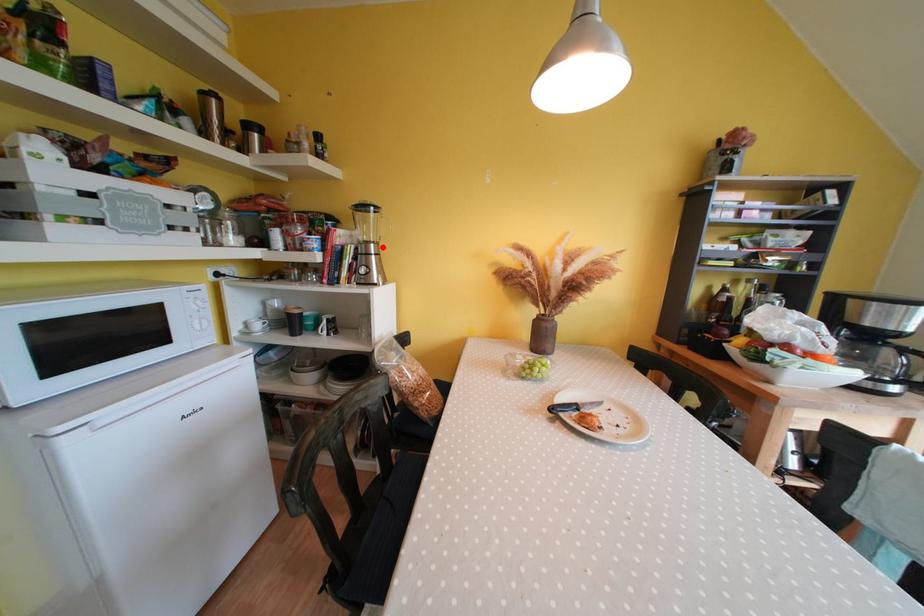
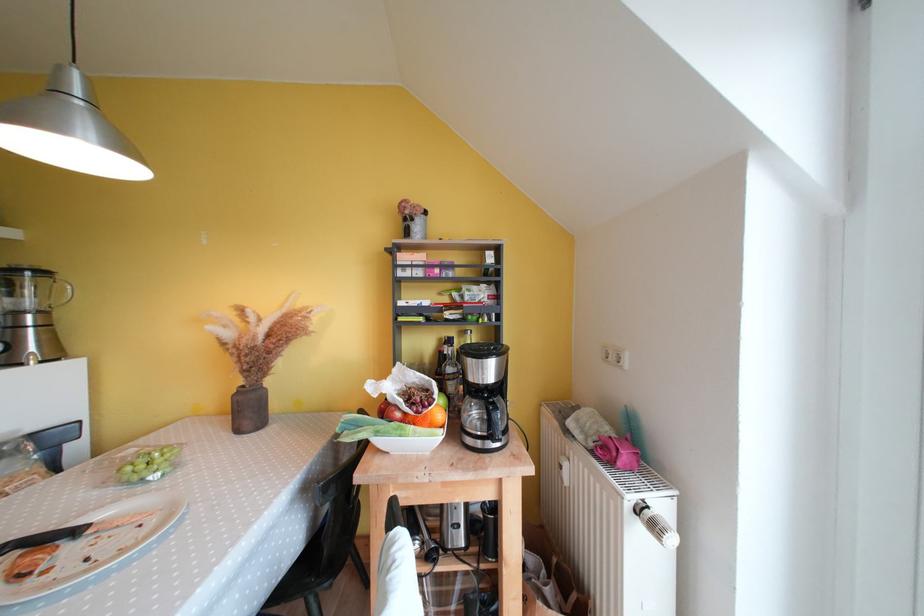
Locate, in the second image, the point that corresponds to the highlighted location in the first image.

(49, 315)